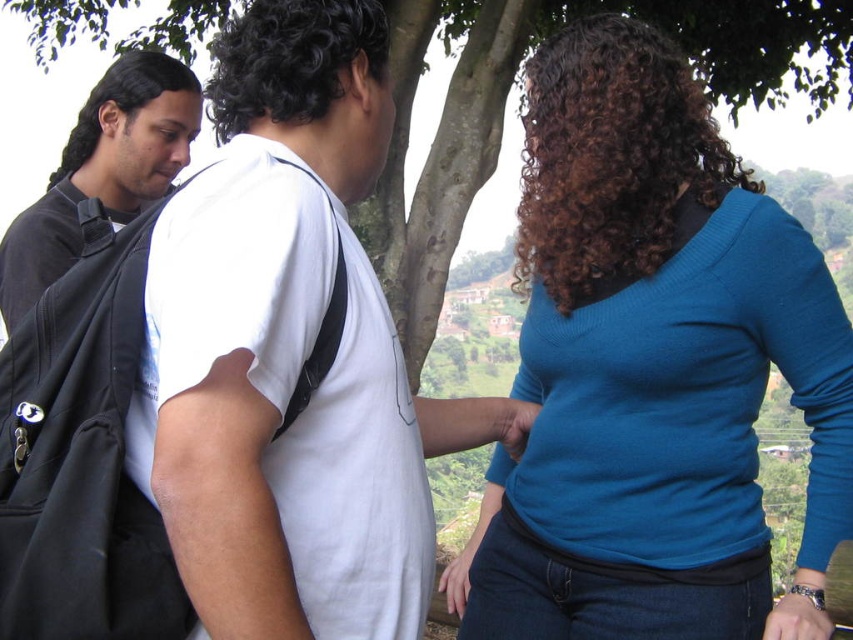
You are a photographer trying to capture a group photo of the blue knit sweater at upper right and the black matte backpack at left. Which object should you focus on first if you want to ensure both are in focus, considering their sizes?

The blue knit sweater at upper right has a greater height compared to the black matte backpack at left, so you should focus on the blue knit sweater at upper right first to ensure both are in focus.